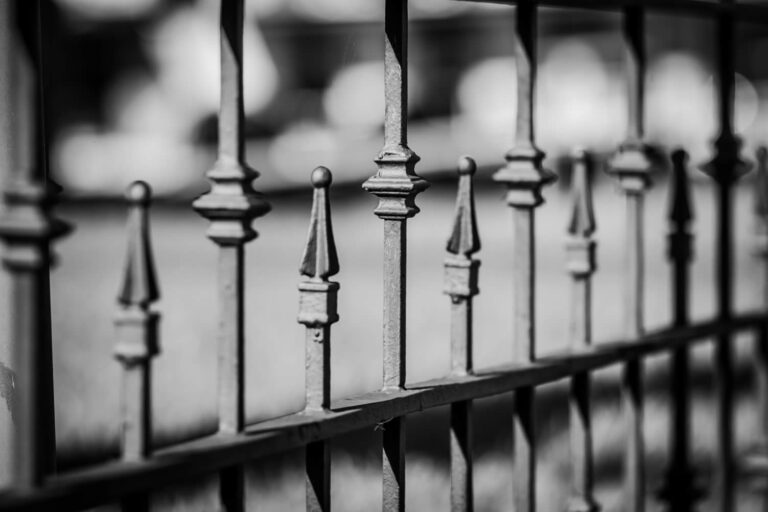
Find the location of a particular element. rod is located at coordinates (723, 297).